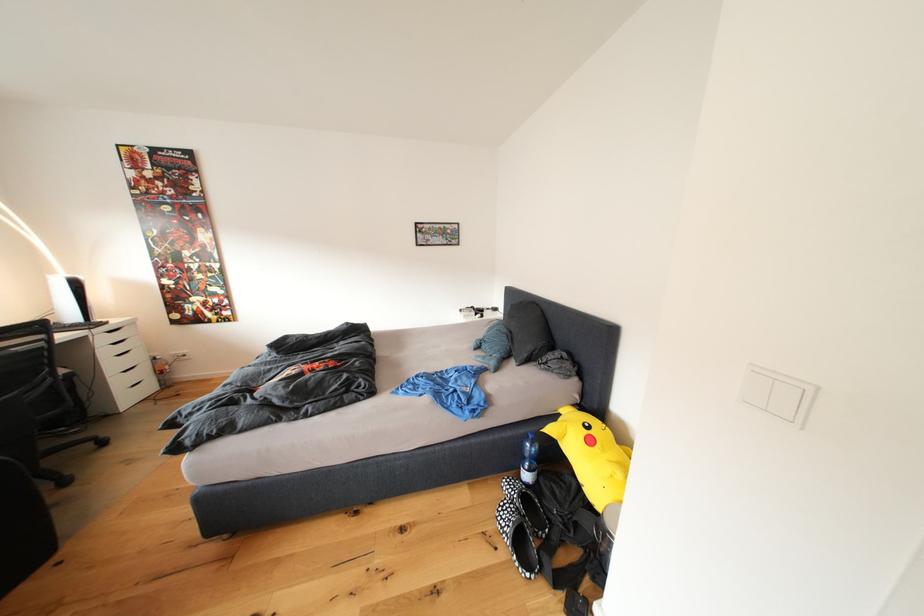
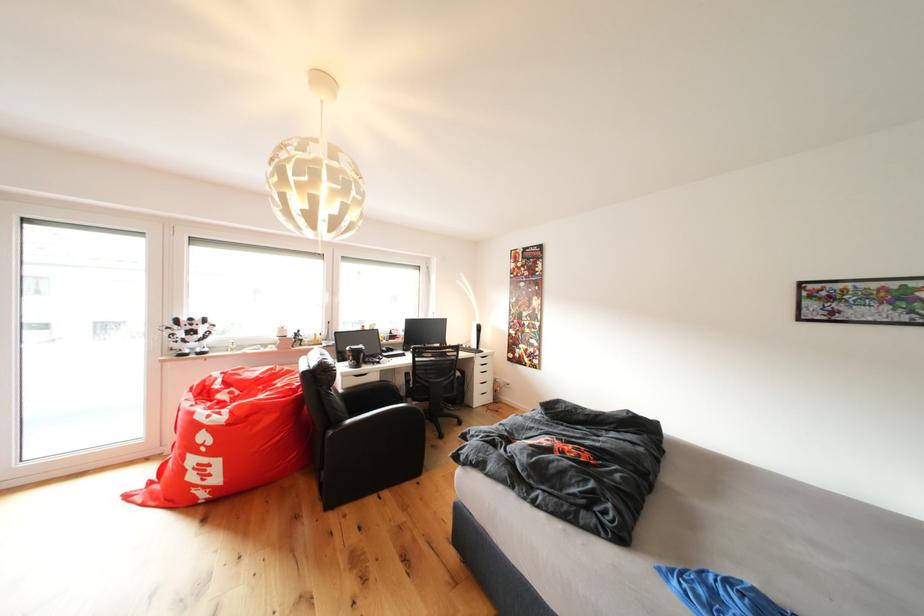
Where in the second image is the point corresponding to pixel 111 344 from the first image?

(487, 366)